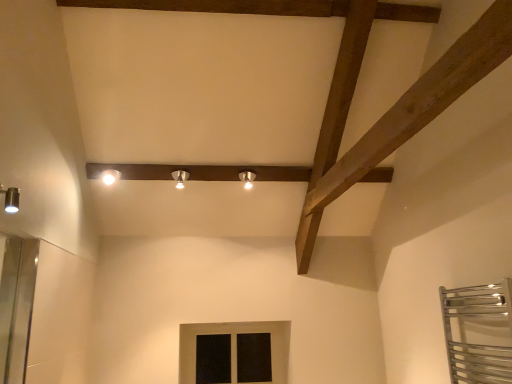
Describe the element at coordinates (110, 176) in the screenshot. I see `white glossy spotlight at upper center, the 1th light fixture positioned from the left` at that location.

What is the approximate width of white glossy spotlight at upper center, the 1th light fixture positioned from the left?

The width of white glossy spotlight at upper center, the 1th light fixture positioned from the left, is 5.58 inches.

I want to click on matte silver spotlight at center, marked as the 2th light fixture in a right-to-left arrangement, so 180,178.

I want to click on white glossy spotlight at upper center, placed as the third light fixture when sorted from right to left, so click(x=110, y=176).

Is black glass window at center positioned with its back to matte silver spotlight at center, marked as the 2th light fixture in a right-to-left arrangement?

No.

Where is `window that is below the matte silver spotlight at center, marked as the 2th light fixture in a right-to-left arrangement (from the image's perspective)`? Image resolution: width=512 pixels, height=384 pixels. window that is below the matte silver spotlight at center, marked as the 2th light fixture in a right-to-left arrangement (from the image's perspective) is located at coordinates (234, 349).

Is black glass window at center further to camera compared to matte silver spotlight at center, positioned as the 2th light fixture in left-to-right order?

Yes, black glass window at center is behind matte silver spotlight at center, positioned as the 2th light fixture in left-to-right order.

Between black glass window at center and matte silver spotlight at center, marked as the 2th light fixture in a right-to-left arrangement, which one has smaller size?

With smaller size is matte silver spotlight at center, marked as the 2th light fixture in a right-to-left arrangement.

Is matte silver spotlight at center, marked as the 2th light fixture in a right-to-left arrangement, looking in the opposite direction of black glass window at center?

No, black glass window at center is not at the back of matte silver spotlight at center, marked as the 2th light fixture in a right-to-left arrangement.

How different are the orientations of matte silver spotlight at center, marked as the 2th light fixture in a right-to-left arrangement, and black glass window at center in degrees?

The facing directions of matte silver spotlight at center, marked as the 2th light fixture in a right-to-left arrangement, and black glass window at center are 2.67 degrees apart.

From the black glass window at center, count the 1st light fixture to the left and point to it. Please provide its 2D coordinates.

[(180, 178)]

Which object is thinner, matte silver spotlight at center, marked as the 2th light fixture in a right-to-left arrangement, or black glass window at center?

black glass window at center.

Considering the relative sizes of white glossy spotlight at upper center, the 1th light fixture positioned from the left, and black glass window at center in the image provided, is white glossy spotlight at upper center, the 1th light fixture positioned from the left, wider than black glass window at center?

Indeed, white glossy spotlight at upper center, the 1th light fixture positioned from the left, has a greater width compared to black glass window at center.

Where is `window to the right of white glossy spotlight at upper center, placed as the third light fixture when sorted from right to left`? window to the right of white glossy spotlight at upper center, placed as the third light fixture when sorted from right to left is located at coordinates (234, 349).

Which object is thinner, white glossy spotlight at upper center, the 1th light fixture positioned from the left, or matte silver spotlight at center, marked as the 2th light fixture in a right-to-left arrangement?

matte silver spotlight at center, marked as the 2th light fixture in a right-to-left arrangement, is thinner.

Does point (114, 172) appear closer or farther from the camera than point (176, 175)?

Point (114, 172).

From a real-world perspective, is white glossy spotlight at upper center, the 1th light fixture positioned from the left, on top of matte silver spotlight at center, marked as the 2th light fixture in a right-to-left arrangement?

No.

Which is more to the left, white glossy spotlight at upper center, placed as the third light fixture when sorted from right to left, or matte silver spotlight at center, marked as the 2th light fixture in a right-to-left arrangement?

white glossy spotlight at upper center, placed as the third light fixture when sorted from right to left, is more to the left.

Considering the sizes of objects black glass window at center and white glossy spotlight at upper center, the 1th light fixture positioned from the left, in the image provided, who is thinner, black glass window at center or white glossy spotlight at upper center, the 1th light fixture positioned from the left,?

black glass window at center.

How different are the orientations of black glass window at center and white glossy spotlight at upper center, placed as the third light fixture when sorted from right to left, in degrees?

The facing directions of black glass window at center and white glossy spotlight at upper center, placed as the third light fixture when sorted from right to left, are 2.67 degrees apart.

Is black glass window at center facing away from white glossy spotlight at upper center, the 1th light fixture positioned from the left?

No, black glass window at center is not facing away from white glossy spotlight at upper center, the 1th light fixture positioned from the left.

Would you say white glossy spotlight at upper center, placed as the third light fixture when sorted from right to left, is part of black glass window at center's contents?

No, white glossy spotlight at upper center, placed as the third light fixture when sorted from right to left, is not a part of black glass window at center.

Does point (252, 176) appear closer or farther from the camera than point (284, 339)?

Point (252, 176) is closer to the camera than point (284, 339).

From a real-world perspective, which is physically above, matte silver spotlight at center, the 1th light fixture positioned from the right, or black glass window at center?

matte silver spotlight at center, the 1th light fixture positioned from the right, is physically above.

From the image's perspective, which one is positioned lower, matte silver spotlight at center, positioned as the 3th light fixture in left-to-right order, or black glass window at center?

black glass window at center appears lower in the image.

Between matte silver spotlight at center, the 1th light fixture positioned from the right, and matte silver spotlight at center, positioned as the 2th light fixture in left-to-right order, which one appears on the right side from the viewer's perspective?

matte silver spotlight at center, the 1th light fixture positioned from the right, is more to the right.

Does matte silver spotlight at center, the 1th light fixture positioned from the right, have a greater height compared to matte silver spotlight at center, marked as the 2th light fixture in a right-to-left arrangement?

Incorrect, the height of matte silver spotlight at center, the 1th light fixture positioned from the right, is not larger of that of matte silver spotlight at center, marked as the 2th light fixture in a right-to-left arrangement.

Considering the relative sizes of matte silver spotlight at center, positioned as the 3th light fixture in left-to-right order, and matte silver spotlight at center, positioned as the 2th light fixture in left-to-right order, in the image provided, is matte silver spotlight at center, positioned as the 3th light fixture in left-to-right order, thinner than matte silver spotlight at center, positioned as the 2th light fixture in left-to-right order,?

Indeed, matte silver spotlight at center, positioned as the 3th light fixture in left-to-right order, has a lesser width compared to matte silver spotlight at center, positioned as the 2th light fixture in left-to-right order.

There is a matte silver spotlight at center, the 1th light fixture positioned from the right. Where is `the 2nd light fixture above it (from a real-world perspective)`? The height and width of the screenshot is (384, 512). the 2nd light fixture above it (from a real-world perspective) is located at coordinates (180, 178).

Locate an element on the screen. window behind the matte silver spotlight at center, positioned as the 2th light fixture in left-to-right order is located at coordinates (234, 349).

I want to click on window below the matte silver spotlight at center, marked as the 2th light fixture in a right-to-left arrangement (from the image's perspective), so click(x=234, y=349).

Considering their positions, is black glass window at center positioned closer to matte silver spotlight at center, the 1th light fixture positioned from the right, than matte silver spotlight at center, marked as the 2th light fixture in a right-to-left arrangement?

matte silver spotlight at center, marked as the 2th light fixture in a right-to-left arrangement, is closer to matte silver spotlight at center, the 1th light fixture positioned from the right.

From the image, which object appears to be farther from matte silver spotlight at center, the 1th light fixture positioned from the right, white glossy spotlight at upper center, placed as the third light fixture when sorted from right to left, or matte silver spotlight at center, marked as the 2th light fixture in a right-to-left arrangement?

white glossy spotlight at upper center, placed as the third light fixture when sorted from right to left, is further to matte silver spotlight at center, the 1th light fixture positioned from the right.

Considering their positions, is matte silver spotlight at center, the 1th light fixture positioned from the right, positioned further to matte silver spotlight at center, marked as the 2th light fixture in a right-to-left arrangement, than white glossy spotlight at upper center, placed as the third light fixture when sorted from right to left?

white glossy spotlight at upper center, placed as the third light fixture when sorted from right to left, is positioned further to the anchor matte silver spotlight at center, marked as the 2th light fixture in a right-to-left arrangement.

Which object lies further to the anchor point white glossy spotlight at upper center, placed as the third light fixture when sorted from right to left, matte silver spotlight at center, positioned as the 2th light fixture in left-to-right order, or matte silver spotlight at center, positioned as the 3th light fixture in left-to-right order?

The object further to white glossy spotlight at upper center, placed as the third light fixture when sorted from right to left, is matte silver spotlight at center, positioned as the 3th light fixture in left-to-right order.

Looking at the image, which one is located closer to black glass window at center, white glossy spotlight at upper center, placed as the third light fixture when sorted from right to left, or matte silver spotlight at center, positioned as the 2th light fixture in left-to-right order?

Based on the image, matte silver spotlight at center, positioned as the 2th light fixture in left-to-right order, appears to be nearer to black glass window at center.

When comparing their distances from matte silver spotlight at center, positioned as the 3th light fixture in left-to-right order, does matte silver spotlight at center, positioned as the 2th light fixture in left-to-right order, or black glass window at center seem closer?

Based on the image, matte silver spotlight at center, positioned as the 2th light fixture in left-to-right order, appears to be nearer to matte silver spotlight at center, positioned as the 3th light fixture in left-to-right order.

Considering their positions, is matte silver spotlight at center, positioned as the 3th light fixture in left-to-right order, positioned further to black glass window at center than matte silver spotlight at center, positioned as the 2th light fixture in left-to-right order?

matte silver spotlight at center, positioned as the 2th light fixture in left-to-right order, is positioned further to the anchor black glass window at center.

Looking at the image, which one is located further to matte silver spotlight at center, the 1th light fixture positioned from the right, white glossy spotlight at upper center, placed as the third light fixture when sorted from right to left, or black glass window at center?

Among the two, black glass window at center is located further to matte silver spotlight at center, the 1th light fixture positioned from the right.

This screenshot has height=384, width=512. In order to click on light fixture between white glossy spotlight at upper center, placed as the third light fixture when sorted from right to left, and matte silver spotlight at center, positioned as the 3th light fixture in left-to-right order, in the horizontal direction in this screenshot , I will do `click(180, 178)`.

Locate an element on the screen. light fixture between matte silver spotlight at center, positioned as the 2th light fixture in left-to-right order, and black glass window at center vertically is located at coordinates (247, 178).